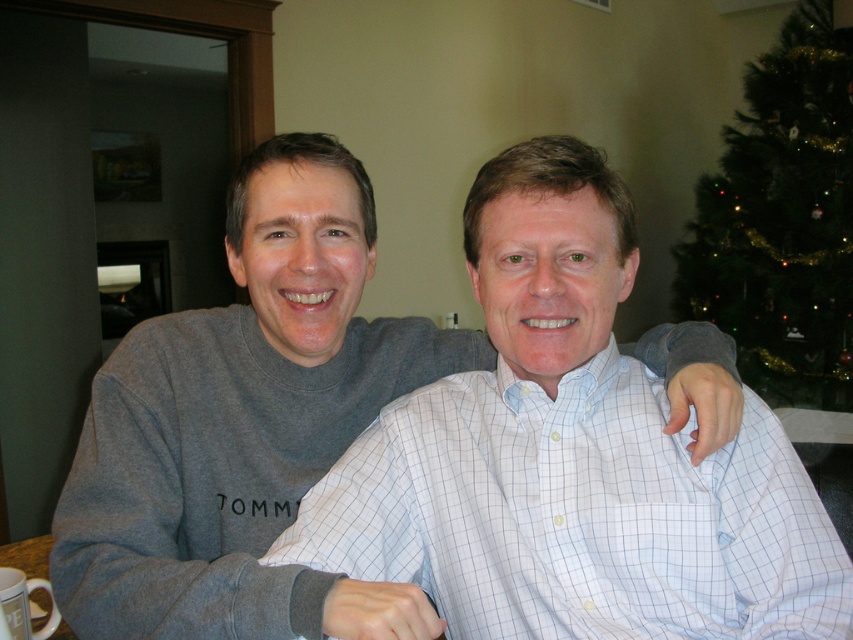
What are the coordinates of the gray cotton shirt at center?

The gray cotton shirt at center is located at coordinates point (242, 420).

You are a photographer trying to capture a group photo of the two people in the scene. The gray cotton shirt at center and the green matte christmas tree at upper right are both in the frame. If you want to ensure that both subjects are fully visible, which one should you adjust the camera angle to focus on first?

The gray cotton shirt at center should be focused on first because its width is larger than the green matte christmas tree at upper right, so it requires more space in the frame to be fully visible.